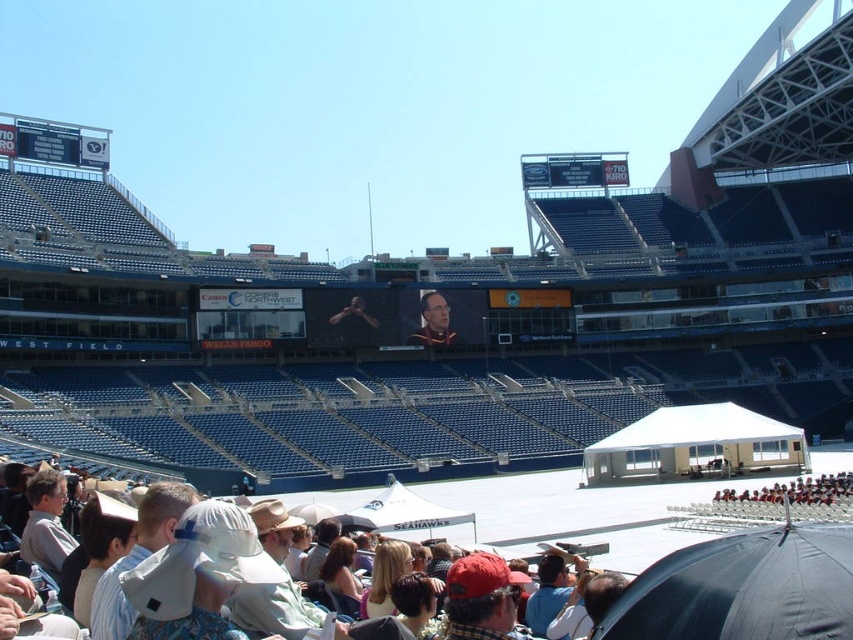
Question: Among these objects, which one is nearest to the camera?

Choices:
 (A) black fabric umbrella at lower right
 (B) matte black suit at center
 (C) blue plastic scoreboard at upper center

Answer: (A)

Question: Which object is closer to the camera taking this photo?

Choices:
 (A) blue plastic scoreboard at upper center
 (B) white digital scoreboard at upper left
 (C) smooth skin face at center

Answer: (B)

Question: Is black fabric umbrella at lower right thinner than matte black suit at center?

Choices:
 (A) yes
 (B) no

Answer: (B)

Question: From the image, what is the correct spatial relationship of blue plastic scoreboard at upper center in relation to matte black suit at center?

Choices:
 (A) right
 (B) left

Answer: (A)

Question: Which of these objects is positioned closest to the matte black suit at center?

Choices:
 (A) black fabric umbrella at lower right
 (B) smooth skin face at center
 (C) blue plastic scoreboard at upper center
 (D) white digital scoreboard at upper left

Answer: (B)

Question: Does black fabric umbrella at lower right have a smaller size compared to white digital scoreboard at upper left?

Choices:
 (A) no
 (B) yes

Answer: (A)